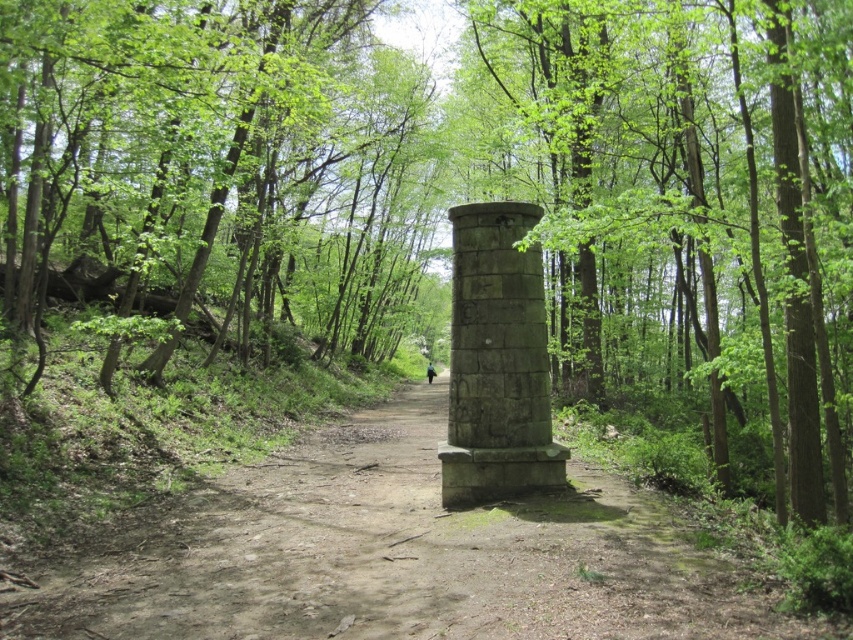
You are standing at the center of the dirt path in the forest scene. You want to know the 2D coordinates of the green leafy trees at left. What are their coordinates?

The 2D coordinates of the green leafy trees at left are at point (218, 170).

You are a hiker trying to navigate through the forest. You see the green leafy trees at left and the dull gray stone path at center. Which object takes up more space in the image?

The green leafy trees at left takes up more space in the image than the dull gray stone path at center because it is larger in size according to the description.